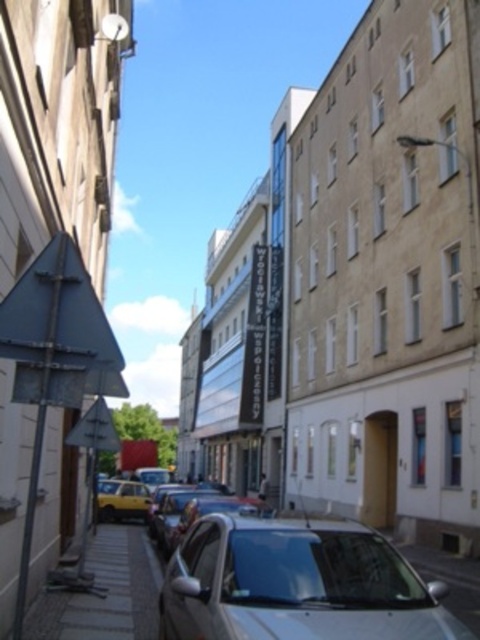
Between point (167, 618) and point (142, 486), which one is positioned in front?

Point (167, 618)

Is point (331, 588) farther from viewer compared to point (132, 493)?

No, it is not.

Between point (436, 636) and point (121, 500), which one is positioned behind?

The point (121, 500) is more distant.

You are a GUI agent. You are given a task and a screenshot of the screen. Output one action in this format:
    pyautogui.click(x=<x>, y=<y>)
    Task: Click on the silver metallic car at lower center
    This screenshot has width=480, height=640.
    Given the screenshot: What is the action you would take?
    pyautogui.click(x=297, y=584)

Identify the location of paved stone alley at lower left. The width and height of the screenshot is (480, 640). (106, 593).

This screenshot has height=640, width=480. In order to click on paved stone alley at lower left in this screenshot , I will do `click(106, 593)`.

Does silver metallic car at lower center have a lesser height compared to paved stone alley at lower left?

Indeed, silver metallic car at lower center has a lesser height compared to paved stone alley at lower left.

Measure the distance between silver metallic car at lower center and camera.

silver metallic car at lower center and camera are 3.83 meters apart from each other.

Where is `silver metallic car at lower center`? The width and height of the screenshot is (480, 640). silver metallic car at lower center is located at coordinates (297, 584).